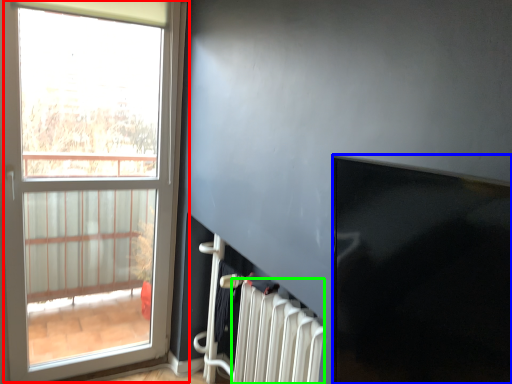
Question: Which object is the closest to the window (highlighted by a red box)? Choose among these: window screen (highlighted by a blue box) or radiator (highlighted by a green box).

Choices:
 (A) window screen
 (B) radiator

Answer: (B)